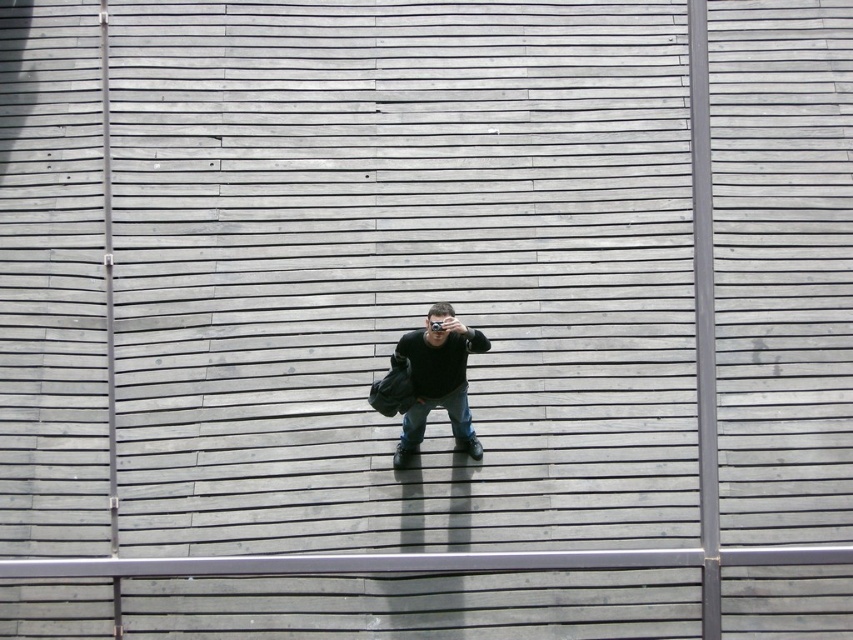
You are standing at the edge of a wooden platform with a matte black camera at center. You want to pick up the camera to take a photo. Is the camera within your immediate reach?

The matte black camera at center is 11.09 meters from viewer, so it is too far to reach immediately. You would need to move closer to pick it up.

You are a photographer trying to adjust your camera. You notice your matte black camera at center and denim jeans at center. Which object is located to the left when viewed from your perspective?

The matte black camera at center is positioned on the left side of denim jeans at center, so it is located to the left when viewed from your perspective.